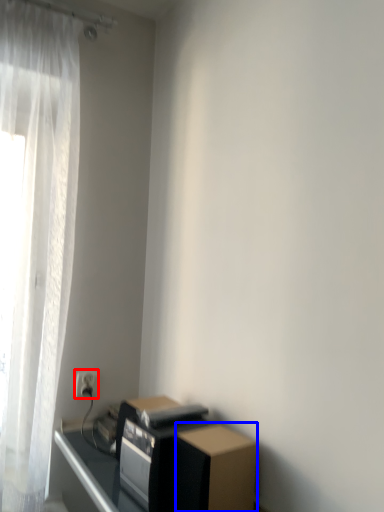
Question: Which object appears farthest to the camera in this image, electric outlet (highlighted by a red box) or cardboard box (highlighted by a blue box)?

Choices:
 (A) electric outlet
 (B) cardboard box

Answer: (A)